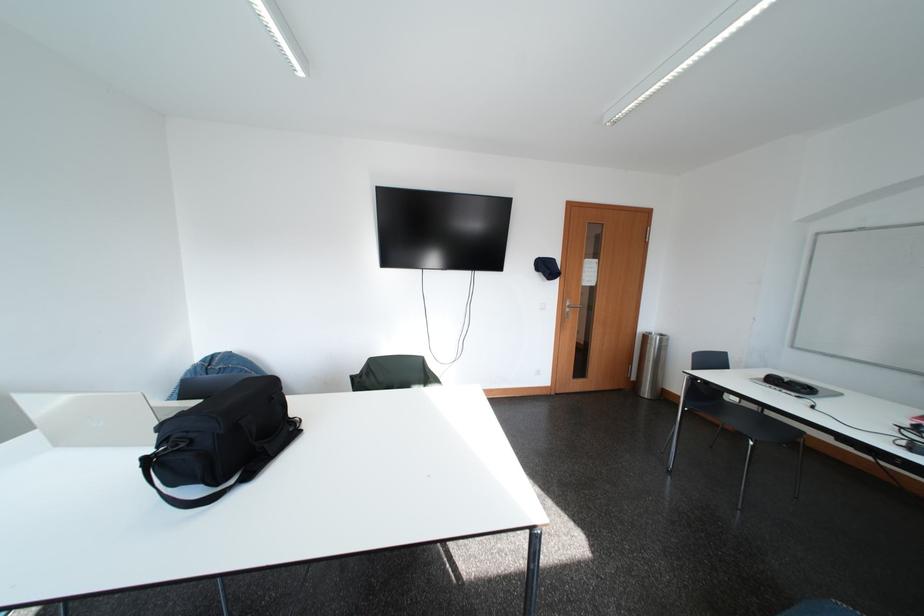
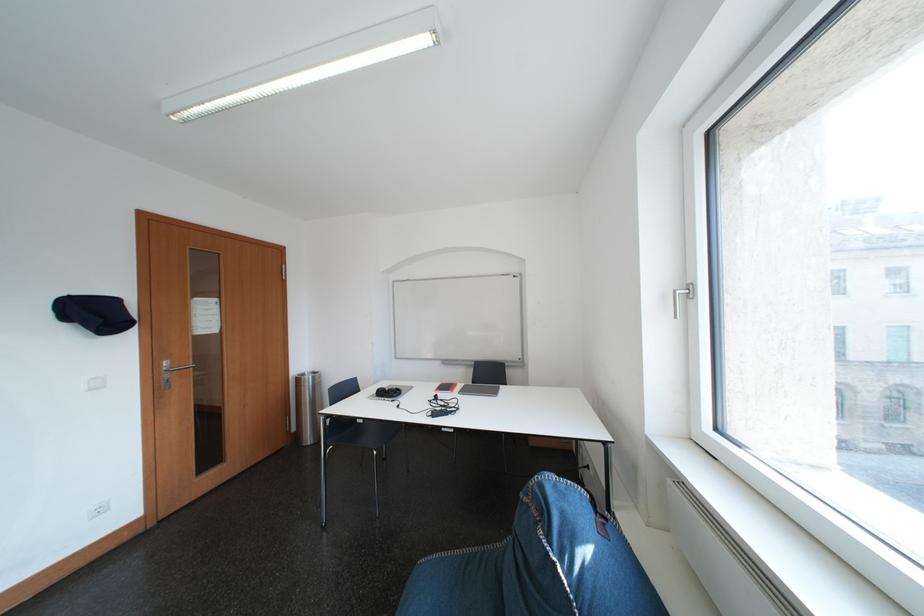
In the second image, find the point that corresponds to the point at 785,384 in the first image.

(393, 395)